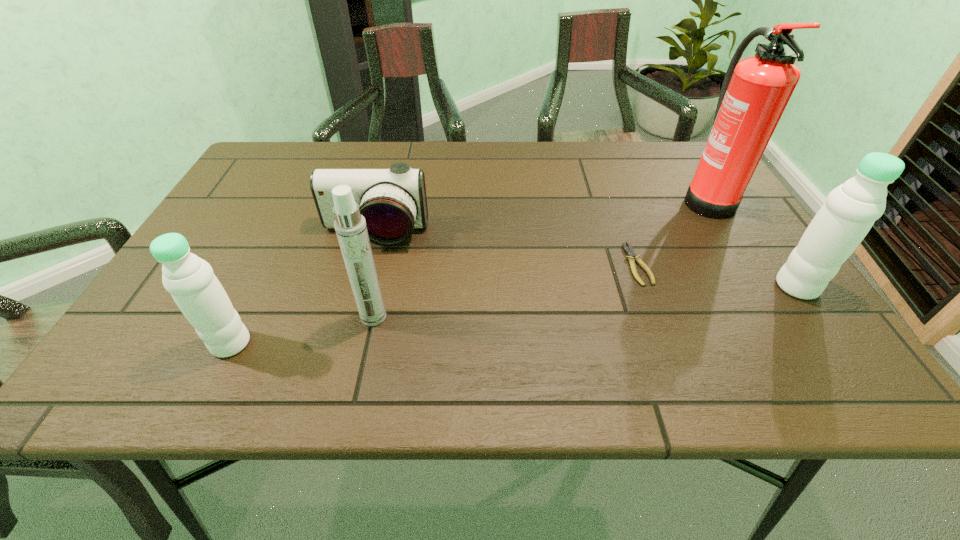
The image size is (960, 540). In order to click on blank area located on the back of the farther water bottle in this screenshot , I will do `click(737, 202)`.

Locate an element on the screen. vacant space situated on the surface of the camcorder is located at coordinates (363, 277).

Where is `vacant space located 0.250m on the left of the shortest object`? vacant space located 0.250m on the left of the shortest object is located at coordinates (514, 264).

I want to click on free space located 0.370m at the nozzle of the tallest object, so click(540, 198).

Find the location of a particular element. vacant space located 0.150m at the nozzle of the tallest object is located at coordinates click(624, 198).

The width and height of the screenshot is (960, 540). Find the location of `blank area located at the nozzle of the tallest object`. blank area located at the nozzle of the tallest object is located at coordinates (609, 198).

In order to click on free space located 0.050m on the back of the aerosol can in this screenshot , I will do [x=380, y=289].

The image size is (960, 540). Identify the location of object that is at the far edge. pos(755,92).

The image size is (960, 540). What are the coordinates of `water bottle that is at the near edge` in the screenshot? It's located at (190, 280).

Find the location of a particular element. aerosol can at the near edge is located at coordinates (350, 226).